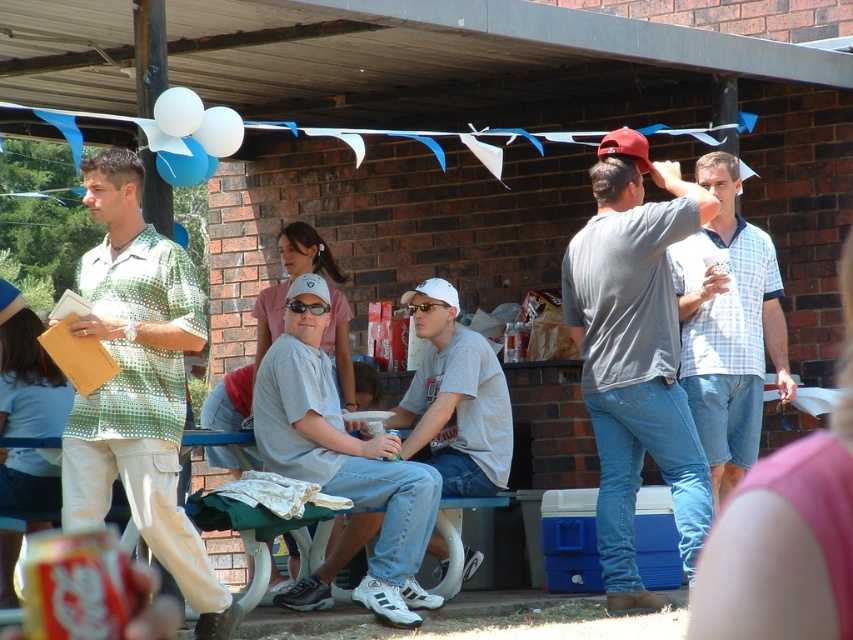
In the scene shown: Who is shorter, green dotted shirt at left or gray matte shirt at center?

gray matte shirt at center is shorter.

Find the location of `green dotted shirt at left`. green dotted shirt at left is located at coordinates (138, 385).

Looking at this image, is light blue plaid shirt at center wider than gray matte shirt at center?

In fact, light blue plaid shirt at center might be narrower than gray matte shirt at center.

What do you see at coordinates (728, 326) in the screenshot? I see `light blue plaid shirt at center` at bounding box center [728, 326].

Image resolution: width=853 pixels, height=640 pixels. Describe the element at coordinates (728, 326) in the screenshot. I see `light blue plaid shirt at center` at that location.

At what (x,y) coordinates should I click in order to perform the action: click on light blue plaid shirt at center. Please return your answer as a coordinate pair (x, y). Looking at the image, I should click on click(x=728, y=326).

Is gray cotton t-shirt at center bigger than green dotted shirt at left?

Yes, gray cotton t-shirt at center is bigger than green dotted shirt at left.

Based on the photo, which is more to the left, gray cotton t-shirt at center or green dotted shirt at left?

green dotted shirt at left

In order to click on gray cotton t-shirt at center in this screenshot , I will do `click(635, 355)`.

Identify the location of gray cotton t-shirt at center. (635, 355).